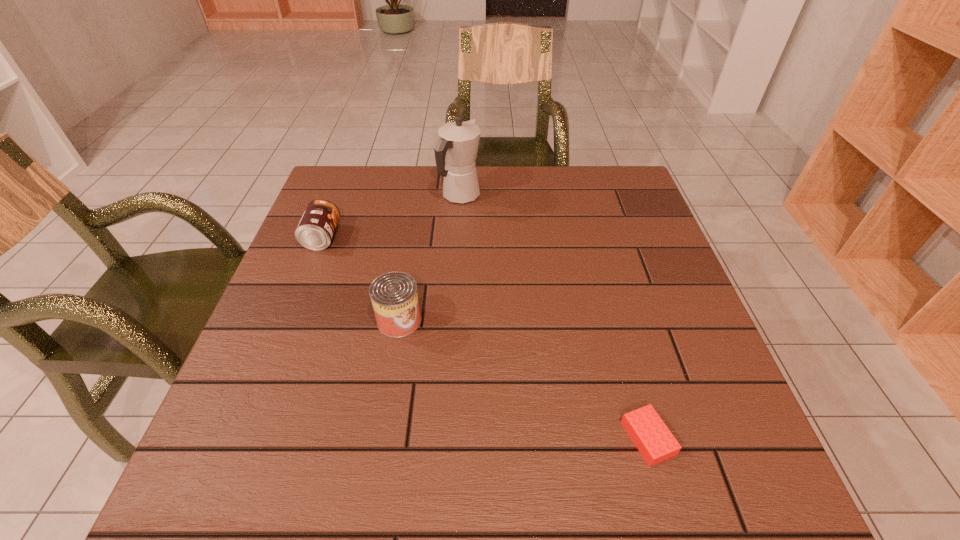
This screenshot has height=540, width=960. What are the coordinates of `vacant point that satisfies the following two spatial constraints: 1. on the front label of the third tallest object; 2. on the right side of the nearest object` in the screenshot? It's located at (243, 438).

Find the location of a particular element. This screenshot has width=960, height=540. free spot that satisfies the following two spatial constraints: 1. on the front label of the shorter can; 2. on the back side of the second tallest object is located at coordinates (290, 320).

Identify the location of free spot that satisfies the following two spatial constraints: 1. on the front label of the left can; 2. on the left side of the second nearest object. (290, 320).